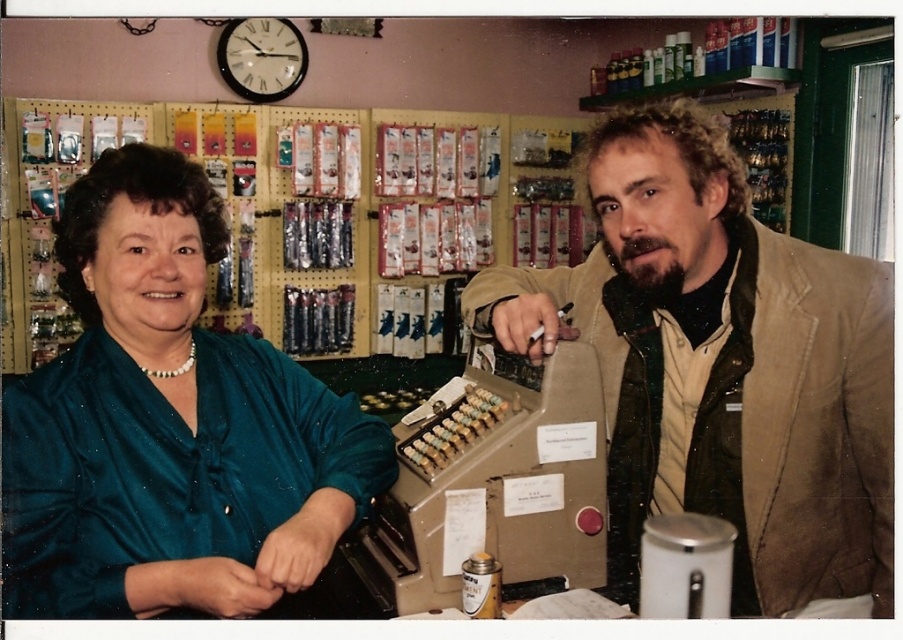
Locate an element on the screen. brown leather jacket at right is located at coordinates (721, 365).

Between brown leather jacket at right and green satin blouse at left, which one appears on the right side from the viewer's perspective?

brown leather jacket at right

Which is behind, point (873, 291) or point (156, 218)?

Point (873, 291)

Image resolution: width=903 pixels, height=640 pixels. I want to click on brown leather jacket at right, so click(x=721, y=365).